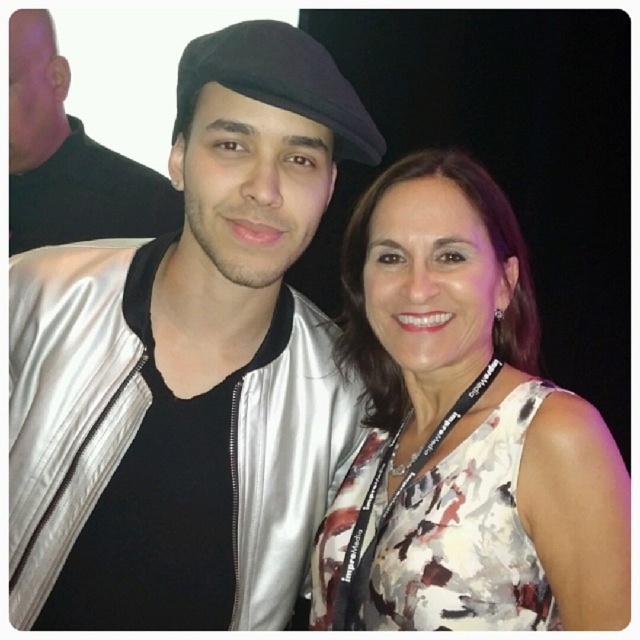
Question: Which of the following is the farthest from the observer?

Choices:
 (A) (580, 520)
 (B) (500, 468)
 (C) (76, 198)
 (D) (84, 280)

Answer: (C)

Question: Can you confirm if satin silver jacket at center is wider than white floral dress at center?

Choices:
 (A) yes
 (B) no

Answer: (A)

Question: Is matte black cap at upper left thinner than black felt beret at center?

Choices:
 (A) yes
 (B) no

Answer: (B)

Question: Which point appears closest to the camera in this image?

Choices:
 (A) (38, 36)
 (B) (384, 429)
 (C) (266, 22)
 (D) (193, 88)

Answer: (C)

Question: Which point is closer to the camera taking this photo?

Choices:
 (A) (493, 371)
 (B) (129, 224)

Answer: (A)

Question: Is matte black cap at upper left behind black felt beret at center?

Choices:
 (A) yes
 (B) no

Answer: (A)